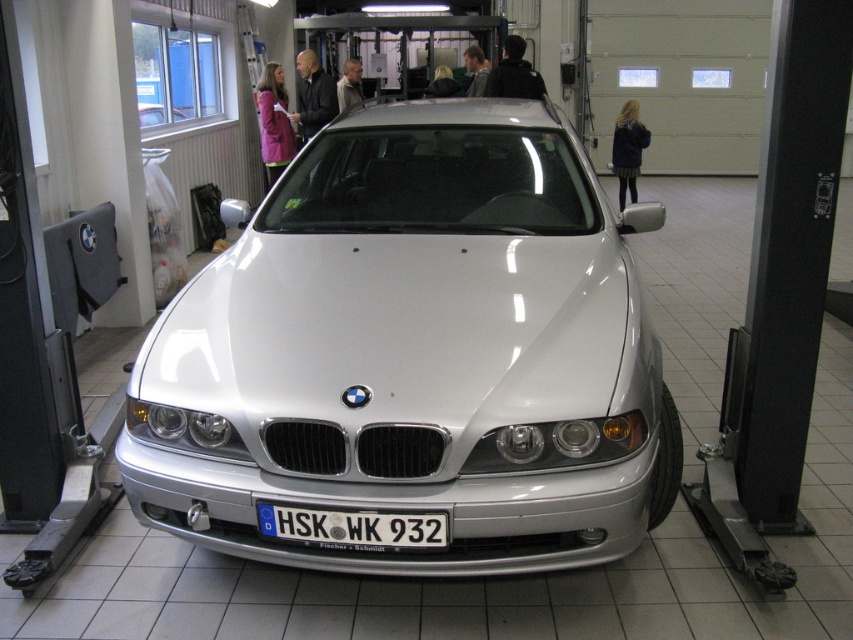
You are a car salesman who needs to show customers the white metallic car at center and the satin silver car at center. Which one would you point to first if you want to mention the one that is closer to the entrance?

The white metallic car at center is closer to the viewer than the satin silver car at center, so you should point to the white metallic car at center first since it is nearer to the entrance.

You are a delivery driver who needs to park your truck next to the garage entrance. There is space between the white metallic car at center and the satin silver car at center. Can your truck, which is 2 meters wide, fit into that space?

The white metallic car at center is larger in size than the satin silver car at center, but the exact width of the space between them isn

You are a delivery person trying to unload a package that requires a clearance of 6 meters. You are standing in front of the garage and see the white plastic license plate at center and the satin silver car at center. Can you determine if the space between them allows the package to pass through?

The white plastic license plate at center and the satin silver car at center are 5.75 meters apart, which is less than the required 6 meters clearance. Therefore, the package cannot pass through the space between them.